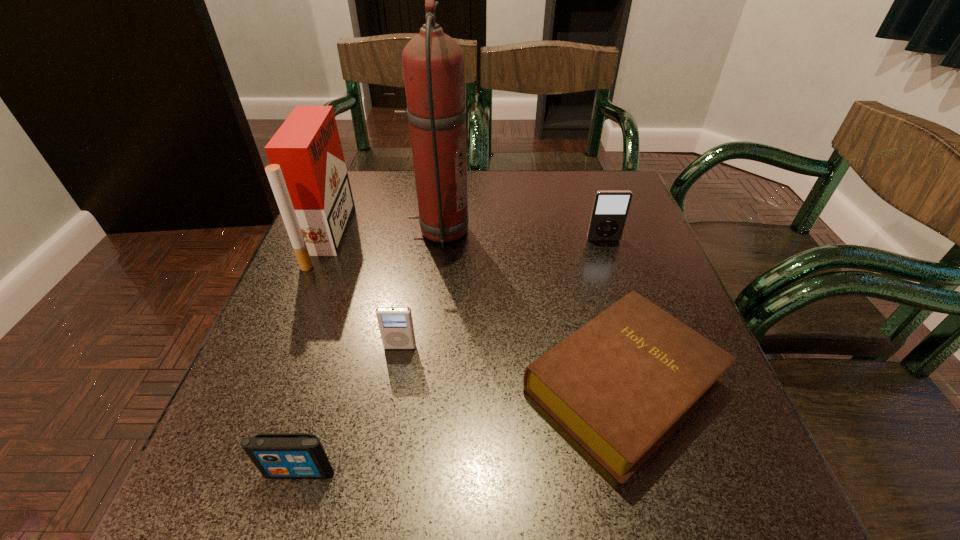
Image resolution: width=960 pixels, height=540 pixels. I want to click on fire extinguisher, so click(433, 62).

The width and height of the screenshot is (960, 540). Identify the location of cigarette case. (307, 173).

In order to click on the second tallest object in this screenshot , I will do `click(307, 173)`.

This screenshot has height=540, width=960. What are the coordinates of `the fourth shortest object` in the screenshot? It's located at (610, 209).

Where is `the farthest iPod`? the farthest iPod is located at coordinates (610, 209).

Where is `the second nearest iPod`? The height and width of the screenshot is (540, 960). the second nearest iPod is located at coordinates pyautogui.click(x=396, y=328).

Where is `the second object from left to right`? The image size is (960, 540). the second object from left to right is located at coordinates (276, 455).

The width and height of the screenshot is (960, 540). I want to click on the nearest iPod, so click(x=276, y=455).

What are the coordinates of `the shortest object` in the screenshot? It's located at (622, 384).

Where is `free space located 0.100m on the side of the fire extinguisher with the label and nozzle`? The image size is (960, 540). free space located 0.100m on the side of the fire extinguisher with the label and nozzle is located at coordinates (511, 231).